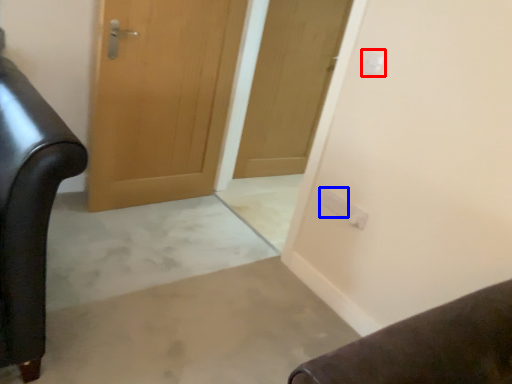
Question: Which object is further to the camera taking this photo, electric outlet (highlighted by a red box) or electric outlet (highlighted by a blue box)?

Choices:
 (A) electric outlet
 (B) electric outlet

Answer: (B)